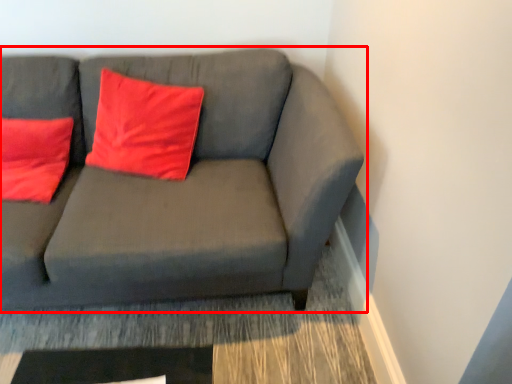
Question: From the image's perspective, where is studio couch (annotated by the red box) located relative to pillow?

Choices:
 (A) above
 (B) below

Answer: (B)